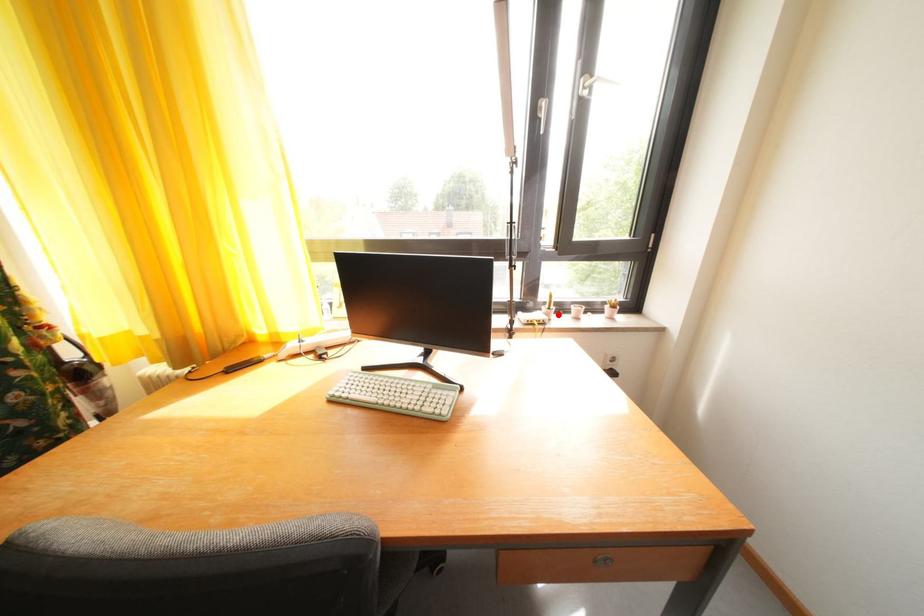
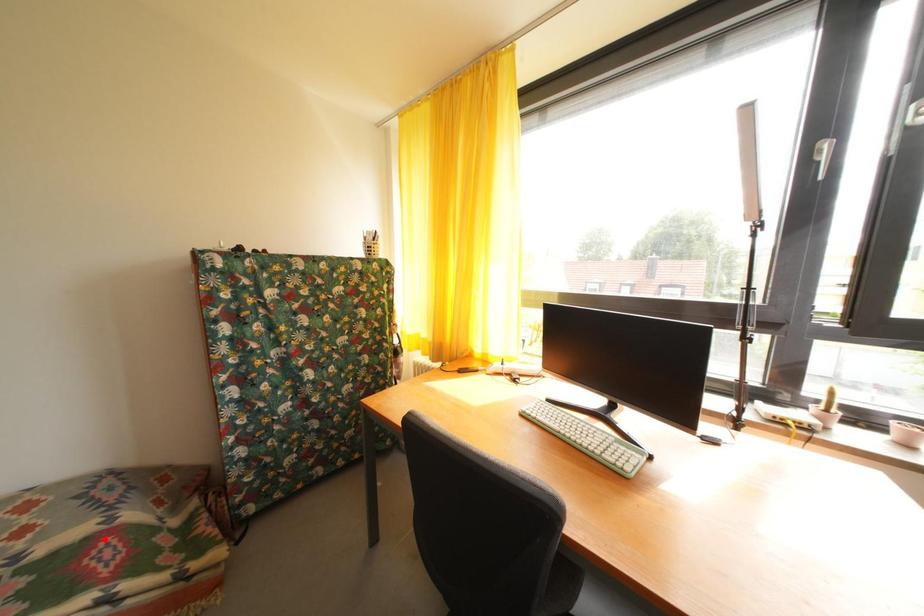
I am providing you with two images of the same scene from different viewpoints. A red point is marked on the first image and another point is marked on the second image. Are the points marked in image1 and image2 representing the same 3D position?

No